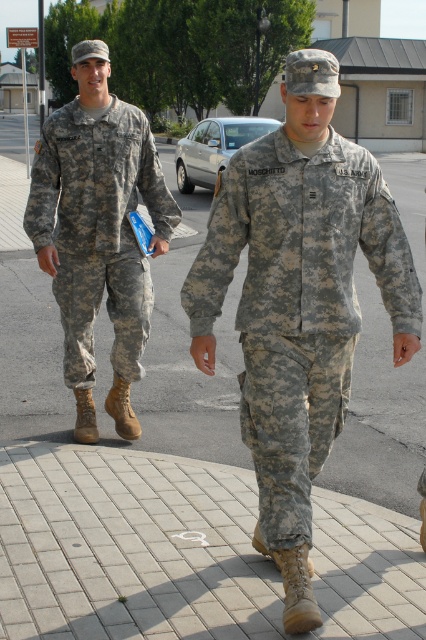
You are a photographer positioned at the sidewalk. You want to take a photo of both the camouflage fabric uniform at left and the light skin tone flesh at center. Which one will appear larger in your photo?

The camouflage fabric uniform at left will appear larger in the photo because it is closer to the viewer than the light skin tone flesh at center.

In the scene described, there are two objects of interest. The first is the camouflage fabric uniform at left, and the second is the matte skin hand at center. From the perspective of an observer looking at the image, which object is positioned more to the left?

The camouflage fabric uniform at left is positioned more to the left than the matte skin hand at center, as stated in the description.

You are a photographer trying to capture a closeup of the matte skin hand at center while ensuring the camouflage fabric uniform at center remains visible in the frame. Can you fit both in the shot without moving the camera?

The camouflage fabric uniform at center is much taller than the matte skin hand at center, so the photographer can likely include both in the frame by adjusting the camera angle or zoom to accommodate the height difference between the two objects.